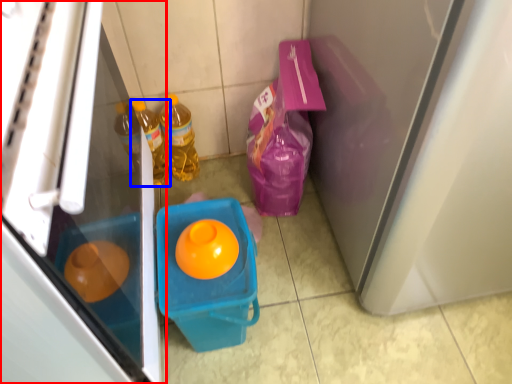
Question: Which of the following is the closest to the observer, refrigerator (highlighted by a red box) or bottle (highlighted by a blue box)?

Choices:
 (A) refrigerator
 (B) bottle

Answer: (A)